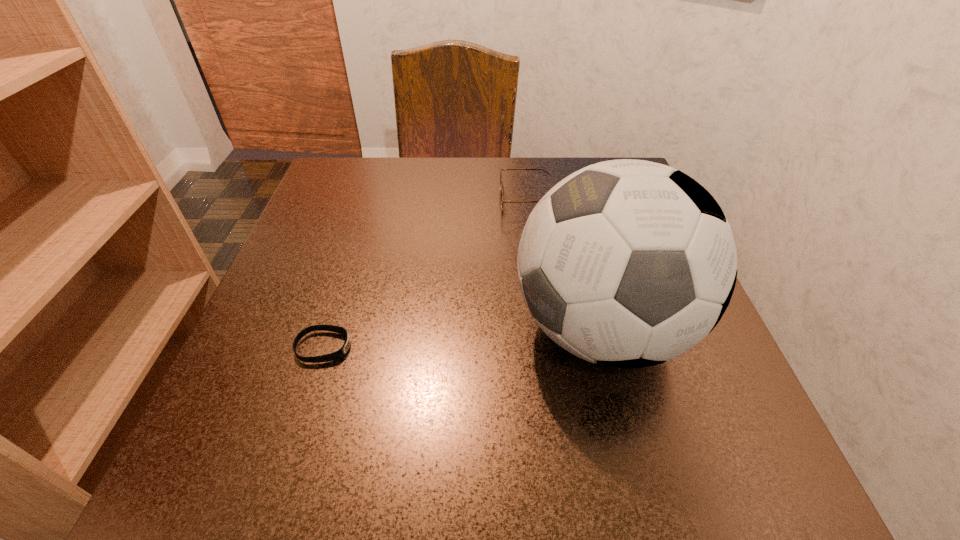
This screenshot has height=540, width=960. In the image, there is a desktop. What are the coordinates of `vacant area at the near left corner` in the screenshot? It's located at (177, 504).

The width and height of the screenshot is (960, 540). In the image, there is a desktop. Identify the location of vacant space at the far right corner. (622, 159).

Find the location of a particular element. Image resolution: width=960 pixels, height=540 pixels. vacant space at the near right corner is located at coordinates (659, 487).

Image resolution: width=960 pixels, height=540 pixels. Identify the location of free space that is in between the shortest object and the spectacles. (425, 274).

Identify the location of free spot between the soccer ball and the wristband. The image size is (960, 540). (463, 338).

Find the location of `vacant area between the soccer ball and the leftmost object`. vacant area between the soccer ball and the leftmost object is located at coordinates (463, 338).

Locate an element on the screen. free spot between the leftmost object and the second tallest object is located at coordinates (425, 274).

Point out which object is positioned as the nearest to the leftmost object. Please provide its 2D coordinates. Your answer should be formatted as a tuple, i.e. [(x, y)], where the tuple contains the x and y coordinates of a point satisfying the conditions above.

[(627, 263)]

Point out which object is positioned as the second nearest to the leftmost object. Please provide its 2D coordinates. Your answer should be formatted as a tuple, i.e. [(x, y)], where the tuple contains the x and y coordinates of a point satisfying the conditions above.

[(501, 169)]